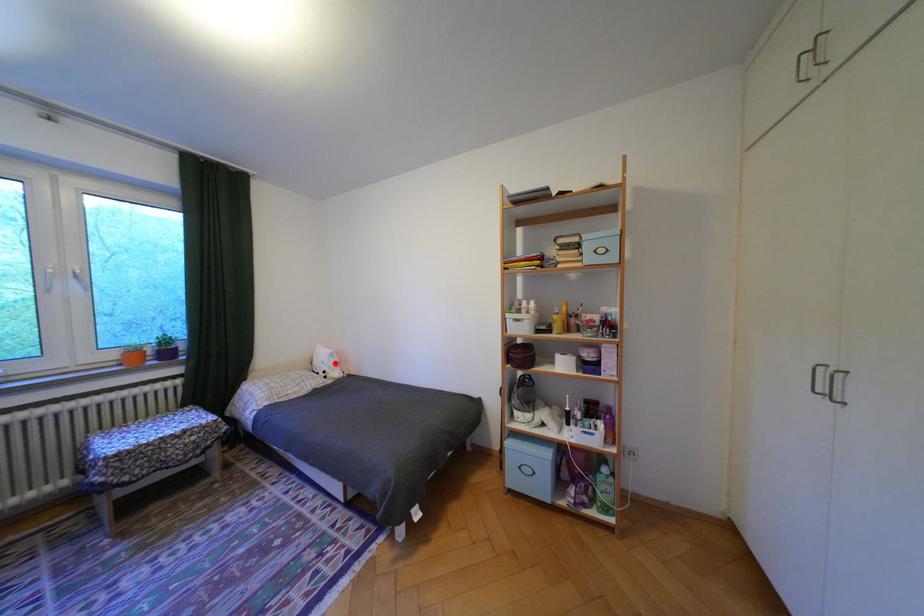
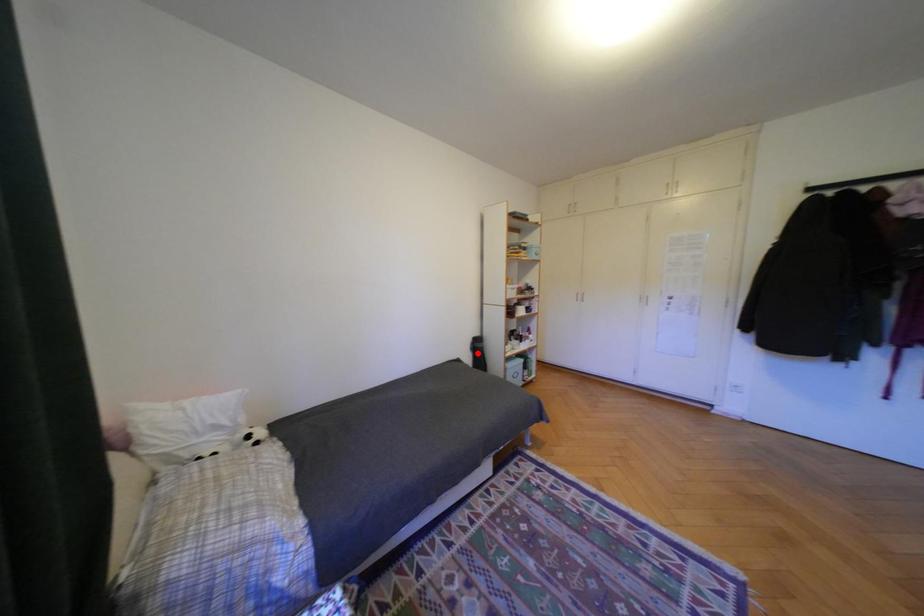
I am providing you with two images of the same scene from different viewpoints. A red point is marked on the first image and another point is marked on the second image. Is the marked point in image1 the same physical position as the marked point in image2?

Answer: No